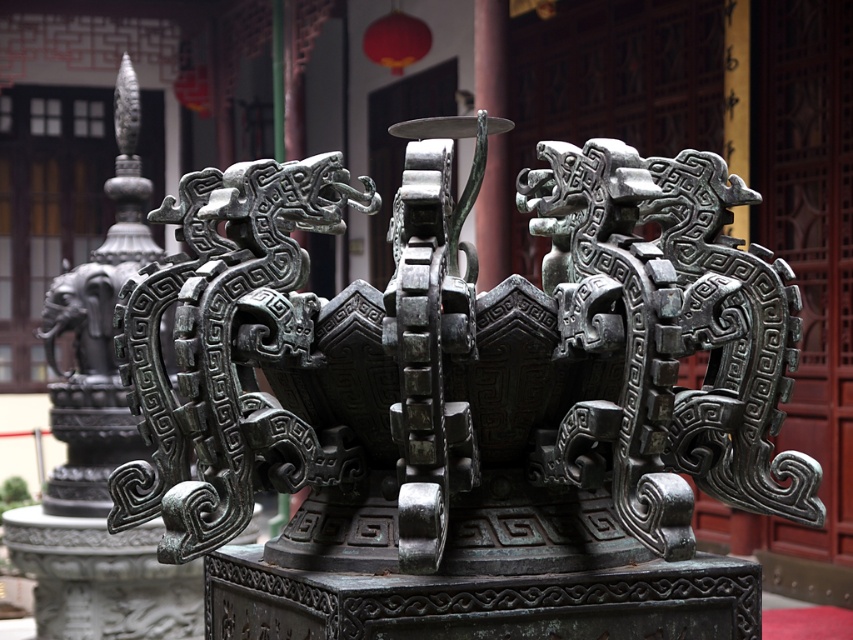
What do you see at coordinates (463, 348) in the screenshot? The width and height of the screenshot is (853, 640). I see `green patina bronze sculpture at center` at bounding box center [463, 348].

Does point (337, 458) come behind point (126, 216)?

That is False.

Where is `green patina bronze sculpture at center`? green patina bronze sculpture at center is located at coordinates (463, 348).